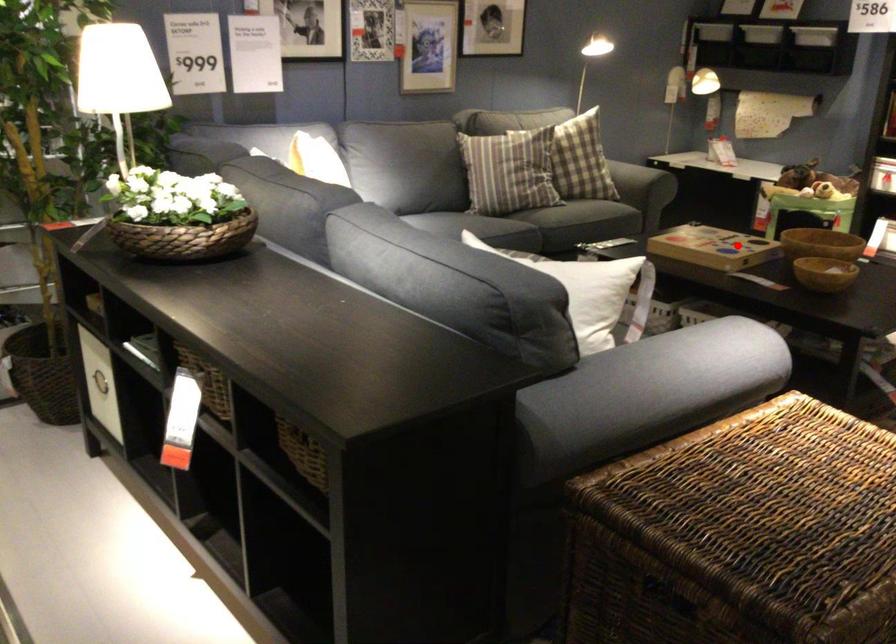
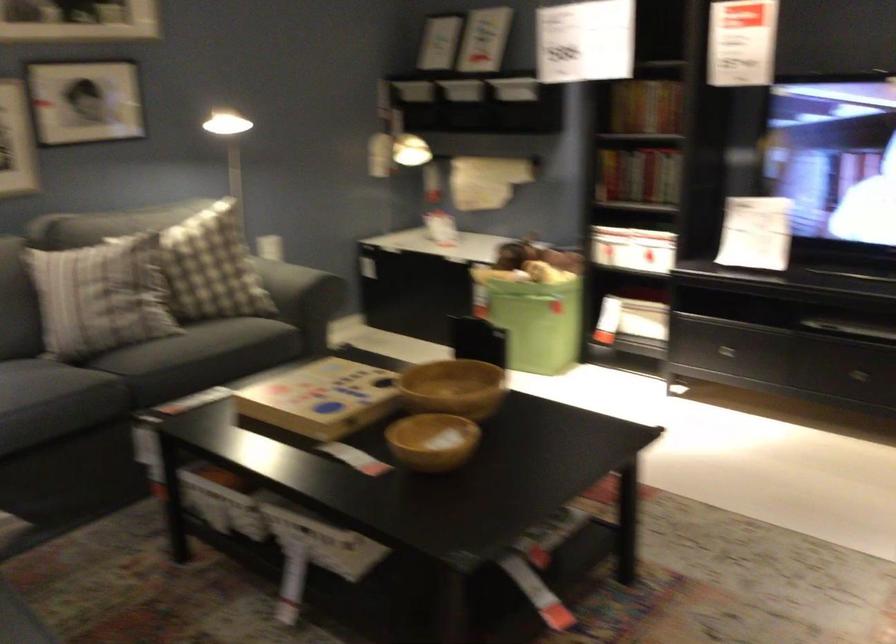
Question: I am providing you with two images of the same scene from different viewpoints. A red point is shown in image1. For the corresponding object point in image2, is it positioned nearer or farther from the camera?

Choices:
 (A) Nearer
 (B) Farther

Answer: (A)